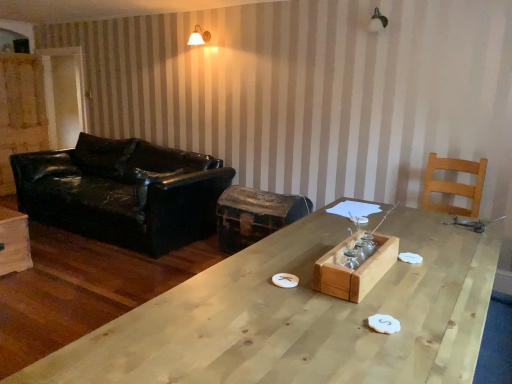
In order to click on black leather couch at left in this screenshot , I will do `click(123, 192)`.

From a real-world perspective, which object stands above the other?

light brown wooden chair at right, from a real-world perspective.

Does light brown wooden chair at right have a lesser height compared to rusty metal trunk at center?

Correct, light brown wooden chair at right is not as tall as rusty metal trunk at center.

This screenshot has width=512, height=384. In order to click on swivel chair below the light brown wooden chair at right (from the image's perspective) in this screenshot , I will do `click(255, 215)`.

Is light brown wooden chair at right to the right of rusty metal trunk at center from the viewer's perspective?

Correct, you'll find light brown wooden chair at right to the right of rusty metal trunk at center.

Which of these two, wooden tray at center or black leather couch at left, is thinner?

wooden tray at center is thinner.

Can you tell me how much wooden tray at center and black leather couch at left differ in facing direction?

wooden tray at center and black leather couch at left are facing 91.6 degrees away from each other.

From a real-world perspective, between wooden tray at center and black leather couch at left, who is vertically lower?

black leather couch at left, from a real-world perspective.

At what (x,y) coordinates should I click in order to perform the action: click on swivel chair in front of the white matte wall sconce at upper center. Please return your answer as a coordinate pair (x, y). The image size is (512, 384). Looking at the image, I should click on (255, 215).

Which object is thinner, white matte wall sconce at upper center or rusty metal trunk at center?

Thinner between the two is white matte wall sconce at upper center.

From a real-world perspective, does white matte wall sconce at upper center stand above rusty metal trunk at center?

Yes.

Is white matte wall sconce at upper center smaller than rusty metal trunk at center?

Indeed, white matte wall sconce at upper center has a smaller size compared to rusty metal trunk at center.

Is point (380, 269) positioned after point (224, 194)?

No, (380, 269) is in front of (224, 194).

Is wooden tray at center aimed at rusty metal trunk at center?

No, wooden tray at center is not facing towards rusty metal trunk at center.

Considering the sizes of objects wooden tray at center and rusty metal trunk at center in the image provided, who is taller, wooden tray at center or rusty metal trunk at center?

rusty metal trunk at center is taller.

From a real-world perspective, which object stands above the other?

In real-world perspective, light brown wooden chair at right is above.

From the picture: Which is in front, light brown wooden chair at right or wooden tray at center?

wooden tray at center is more forward.

From the image's perspective, is light brown wooden chair at right beneath wooden tray at center?

No, from the image's perspective, light brown wooden chair at right is not below wooden tray at center.

Is light brown wooden chair at right thinner than wooden tray at center?

No, light brown wooden chair at right is not thinner than wooden tray at center.

Is natural wood table at center smaller than black leather couch at left?

Yes.

Between natural wood table at center and black leather couch at left, which one has smaller width?

natural wood table at center.

At what (x,y) coordinates should I click in order to perform the action: click on table in front of the black leather couch at left. Please return your answer as a coordinate pair (x, y). Looking at the image, I should click on (300, 316).

Is natural wood table at center located outside black leather couch at left?

natural wood table at center is positioned outside black leather couch at left.

Between white matte wall sconce at upper center and natural wood table at center, which one appears on the right side from the viewer's perspective?

natural wood table at center is more to the right.

Between white matte wall sconce at upper center and natural wood table at center, which one has smaller width?

With smaller width is white matte wall sconce at upper center.

In the image, is white matte wall sconce at upper center positioned in front of or behind natural wood table at center?

In the image, white matte wall sconce at upper center appears behind natural wood table at center.

The width and height of the screenshot is (512, 384). In order to click on chair above the rusty metal trunk at center (from a real-world perspective) in this screenshot , I will do `click(454, 185)`.

In the image, there is a black leather couch at left. At what (x,y) coordinates should I click in order to perform the action: click on crate below it (from the image's perspective). Please return your answer as a coordinate pair (x, y). Looking at the image, I should click on (354, 269).

From the image, which object appears to be farther from natural wood table at center, rusty metal trunk at center or light brown wooden chair at right?

rusty metal trunk at center lies further to natural wood table at center than the other object.

Which object lies nearer to the anchor point black leather couch at left, natural wood table at center or rusty metal trunk at center?

rusty metal trunk at center.

Which object lies nearer to the anchor point black leather couch at left, rusty metal trunk at center or natural wood table at center?

rusty metal trunk at center lies closer to black leather couch at left than the other object.

Which object lies further to the anchor point light brown wooden chair at right, wooden tray at center or black leather couch at left?

Among the two, black leather couch at left is located further to light brown wooden chair at right.

When comparing their distances from light brown wooden chair at right, does rusty metal trunk at center or wooden tray at center seem closer?

rusty metal trunk at center is positioned closer to the anchor light brown wooden chair at right.

Which object lies nearer to the anchor point wooden tray at center, white matte wall sconce at upper center or rusty metal trunk at center?

Among the two, rusty metal trunk at center is located nearer to wooden tray at center.

Which object lies nearer to the anchor point white matte wall sconce at upper center, rusty metal trunk at center or light brown wooden chair at right?

The object closer to white matte wall sconce at upper center is rusty metal trunk at center.

Which object lies further to the anchor point black leather couch at left, wooden tray at center or natural wood table at center?

The object further to black leather couch at left is wooden tray at center.

Locate an element on the screen. This screenshot has height=384, width=512. chair between white matte wall sconce at upper center and rusty metal trunk at center in the vertical direction is located at coordinates (454, 185).

The image size is (512, 384). Find the location of `chair between natural wood table at center and rusty metal trunk at center from front to back`. chair between natural wood table at center and rusty metal trunk at center from front to back is located at coordinates (454, 185).

Identify the location of studio couch between natural wood table at center and rusty metal trunk at center from front to back. This screenshot has height=384, width=512. (123, 192).

Image resolution: width=512 pixels, height=384 pixels. Find the location of `studio couch between wooden tray at center and rusty metal trunk at center from front to back`. studio couch between wooden tray at center and rusty metal trunk at center from front to back is located at coordinates (123, 192).